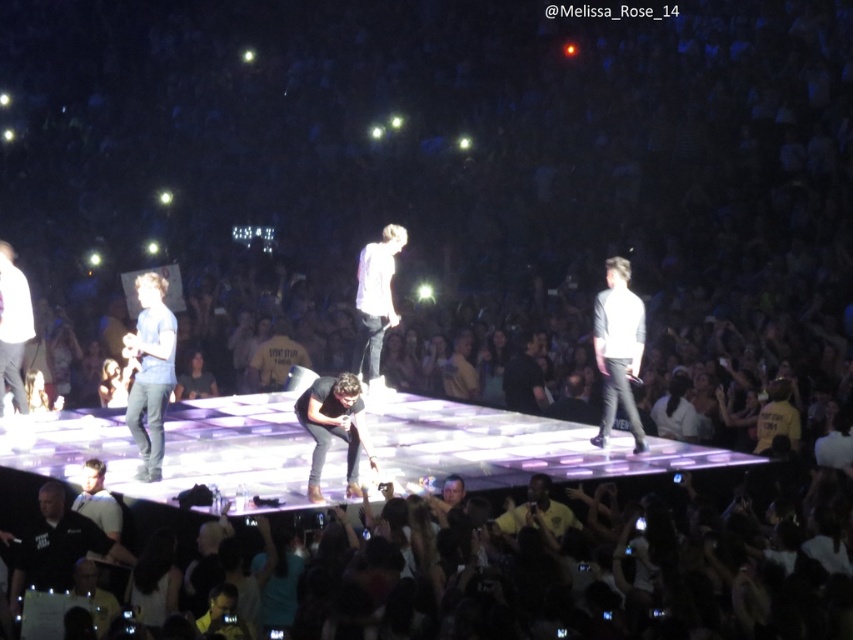
Question: Which point is farther to the camera?

Choices:
 (A) yellow jersey at center
 (B) white matte shirt at center
 (C) black matte shirt at center
 (D) white matte shirt at right

Answer: (A)

Question: Does black shirt at lower left have a greater width compared to yellow jersey at center?

Choices:
 (A) no
 (B) yes

Answer: (B)

Question: Estimate the real-world distances between objects in this image. Which object is closer to the white matte shirt at center?

Choices:
 (A) black shirt at lower left
 (B) white matte shirt at right

Answer: (B)

Question: Is matte blue shirt at left above black matte shirt at center?

Choices:
 (A) no
 (B) yes

Answer: (B)

Question: Is matte blue shirt at left to the left of black matte shirt at center from the viewer's perspective?

Choices:
 (A) yes
 (B) no

Answer: (A)

Question: Estimate the real-world distances between objects in this image. Which object is farther from the yellow jersey at center?

Choices:
 (A) white matte shirt at right
 (B) matte blue shirt at left
 (C) black matte shirt at center

Answer: (A)